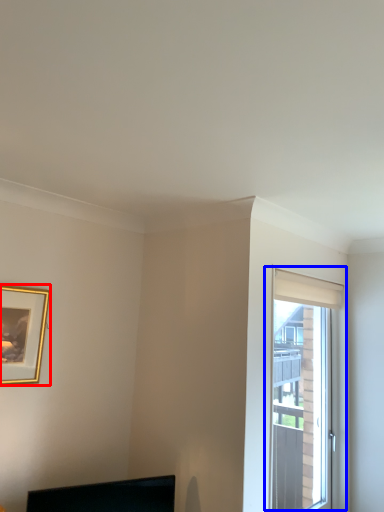
Question: Which object appears closest to the camera in this image, picture frame (highlighted by a red box) or window (highlighted by a blue box)?

Choices:
 (A) picture frame
 (B) window

Answer: (A)